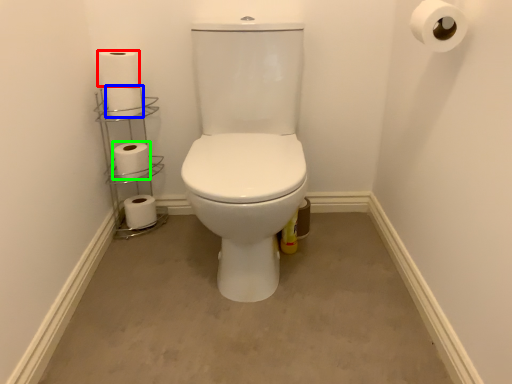
Question: Based on their relative distances, which object is farther from toilet paper (highlighted by a red box)? Choose from toilet paper (highlighted by a blue box) and toilet paper (highlighted by a green box).

Choices:
 (A) toilet paper
 (B) toilet paper

Answer: (B)